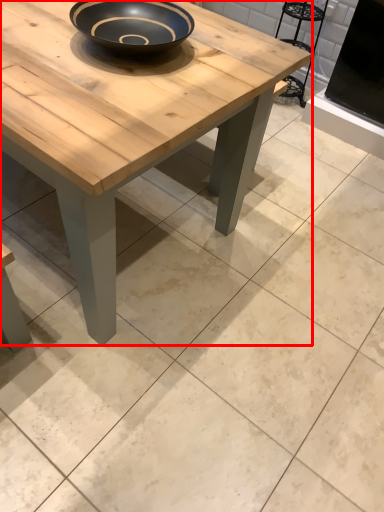
Question: Observing the image, what is the correct spatial positioning of coffee table (annotated by the red box) in reference to chair?

Choices:
 (A) right
 (B) left

Answer: (B)